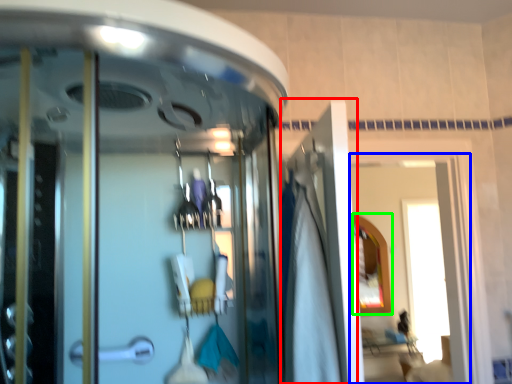
Question: Estimate the real-world distances between objects in this image. Which object is closer to door (highlighted by a red box), window (highlighted by a blue box) or mirror (highlighted by a green box)?

Choices:
 (A) window
 (B) mirror

Answer: (B)